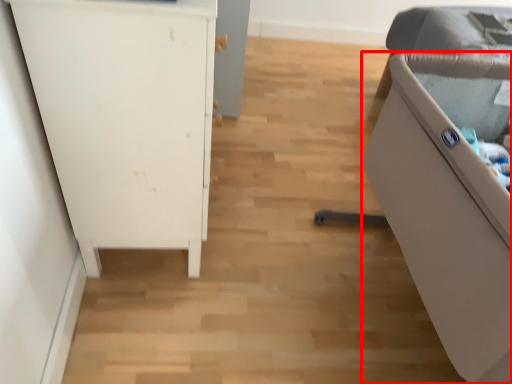
Question: From the image's perspective, where is furniture (annotated by the red box) located relative to furniture?

Choices:
 (A) below
 (B) above

Answer: (A)